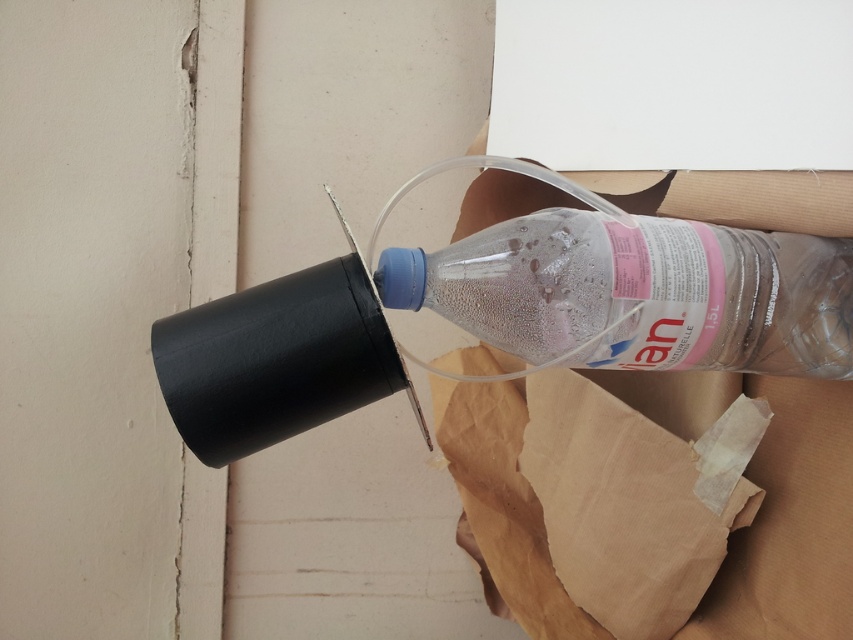
Question: Where is black matte wine bottle at upper center located in relation to transparent plastic bottle at center in the image?

Choices:
 (A) right
 (B) left

Answer: (B)

Question: Considering the real-world distances, which object is closest to the transparent plastic bottle at center?

Choices:
 (A) transparent paper at upper right
 (B) black matte wine bottle at upper center

Answer: (B)

Question: Estimate the real-world distances between objects in this image. Which object is farther from the transparent plastic bottle at center?

Choices:
 (A) black matte wine bottle at upper center
 (B) transparent paper at upper right

Answer: (B)

Question: Which of the following is the farthest from the observer?

Choices:
 (A) (601, 362)
 (B) (798, 294)

Answer: (A)

Question: Is transparent paper at upper right to the right of black matte wine bottle at upper center from the viewer's perspective?

Choices:
 (A) no
 (B) yes

Answer: (B)

Question: Can you confirm if transparent paper at upper right is smaller than black matte wine bottle at upper center?

Choices:
 (A) yes
 (B) no

Answer: (B)